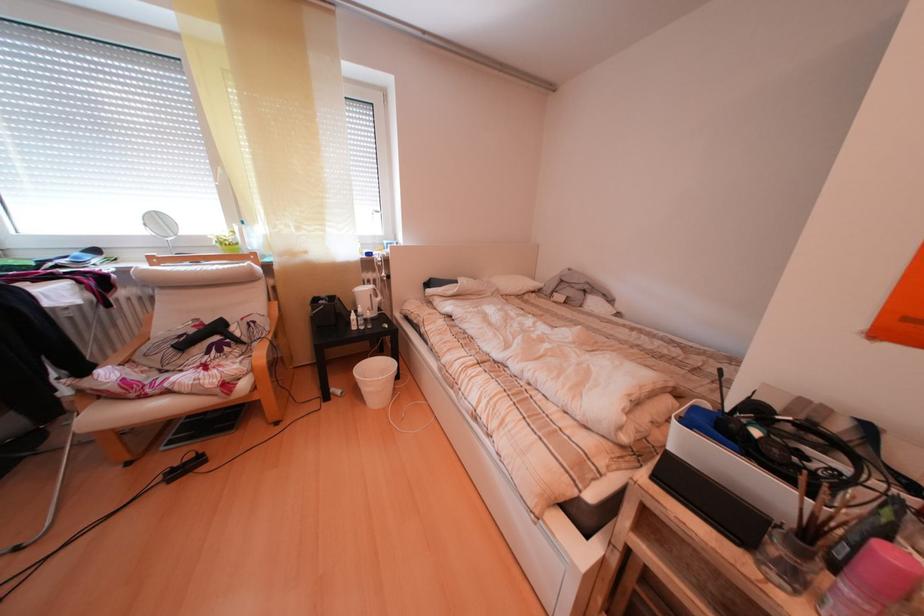
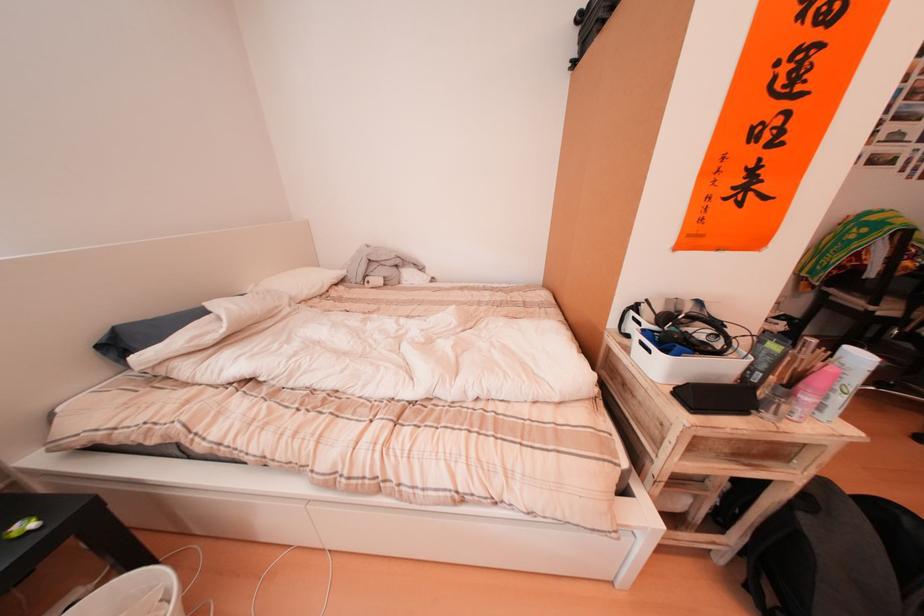
Find the pixel in the second image that matches point (578, 290) in the first image.

(390, 270)